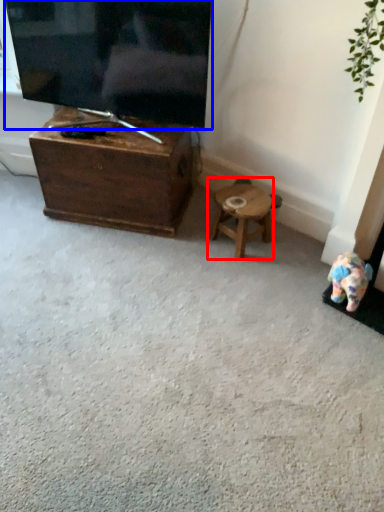
Question: Which point is closer to the camera, stool (highlighted by a red box) or television (highlighted by a blue box)?

Choices:
 (A) stool
 (B) television

Answer: (B)